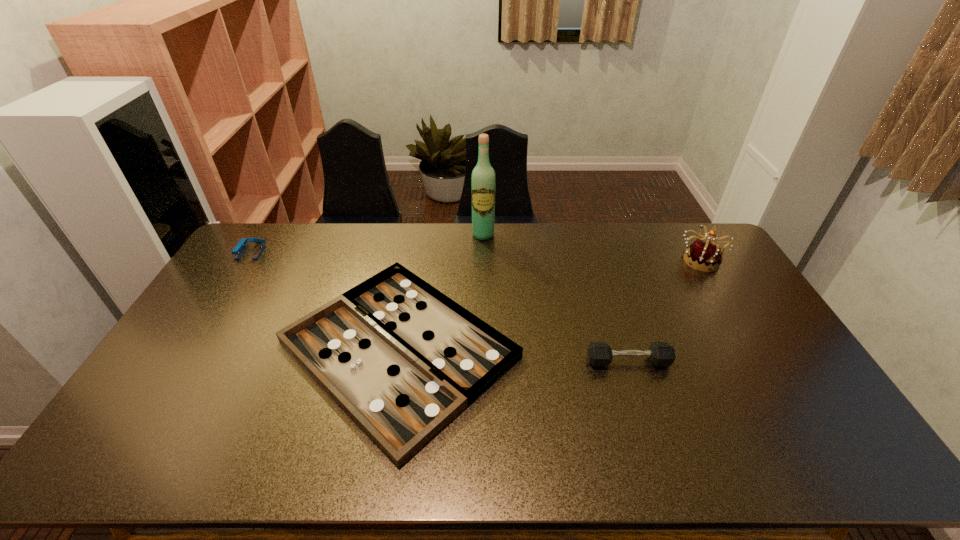
You are a GUI agent. You are given a task and a screenshot of the screen. Output one action in this format:
    pyautogui.click(x=<x>, y=<y>)
    Task: Click on the vacant area between the tallest object and the stapler
    This screenshot has width=960, height=540.
    Given the screenshot: What is the action you would take?
    pyautogui.click(x=367, y=243)

Locate an element on the screen. This screenshot has width=960, height=540. object that can be found as the second closest to the second shortest object is located at coordinates (705, 255).

Where is `the fourth closest object to the fourth object from left to right`? the fourth closest object to the fourth object from left to right is located at coordinates (238, 250).

The width and height of the screenshot is (960, 540). Find the location of `free space that satisfies the following two spatial constraints: 1. on the front side of the dumbbell; 2. on the left side of the shortest object`. free space that satisfies the following two spatial constraints: 1. on the front side of the dumbbell; 2. on the left side of the shortest object is located at coordinates (396, 361).

The image size is (960, 540). I want to click on vacant space that satisfies the following two spatial constraints: 1. on the front side of the gameboard; 2. on the left side of the fourth tallest object, so tap(396, 361).